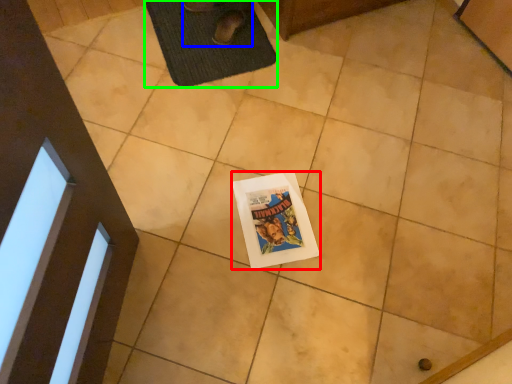
Question: Considering the real-world distances, which object is farthest from comic book (highlighted by a red box)? person (highlighted by a blue box) or bath mat (highlighted by a green box)?

Choices:
 (A) person
 (B) bath mat

Answer: (A)